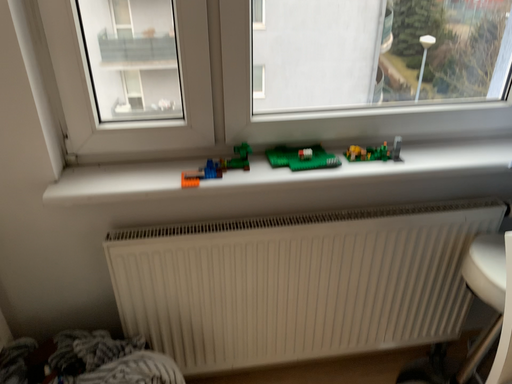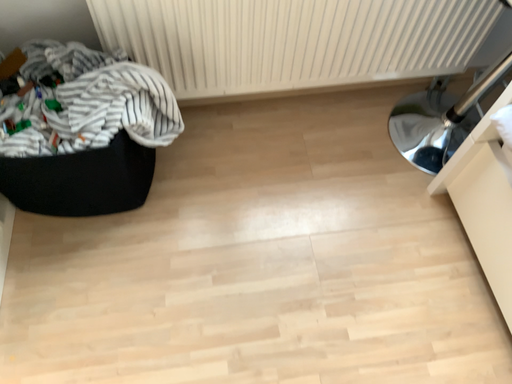
Question: How did the camera likely rotate when shooting the video?

Choices:
 (A) rotated upward
 (B) rotated downward

Answer: (B)